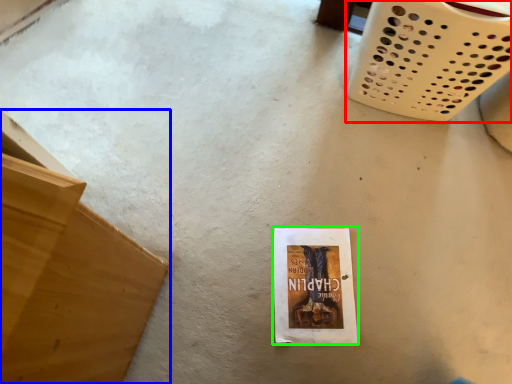
Question: Which is nearer to the basket (highlighted by a red box)? furniture (highlighted by a blue box) or paperback book (highlighted by a green box).

Choices:
 (A) furniture
 (B) paperback book

Answer: (B)